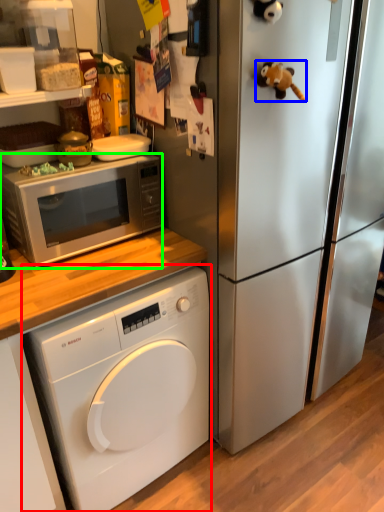
Question: Based on their relative distances, which object is farther from washing machine (highlighted by a red box)? Choose from toy (highlighted by a blue box) and microwave oven (highlighted by a green box).

Choices:
 (A) toy
 (B) microwave oven

Answer: (A)